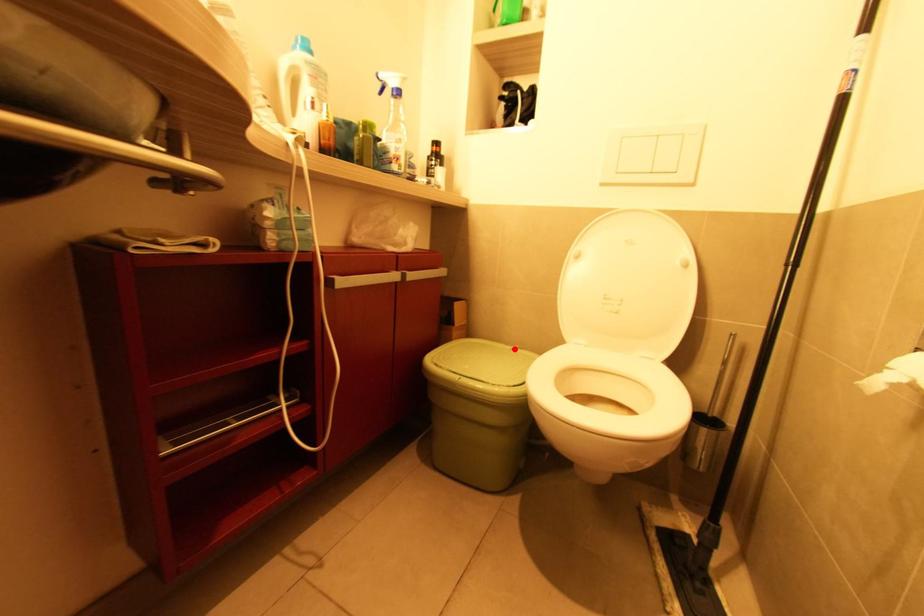
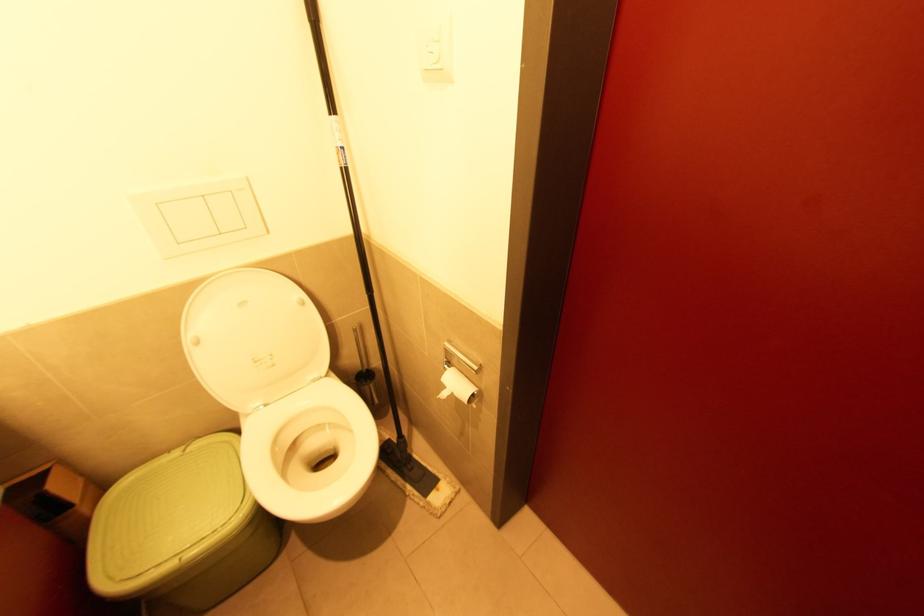
Where in the second image is the point corresponding to the highlighted location from the first image?

(187, 452)